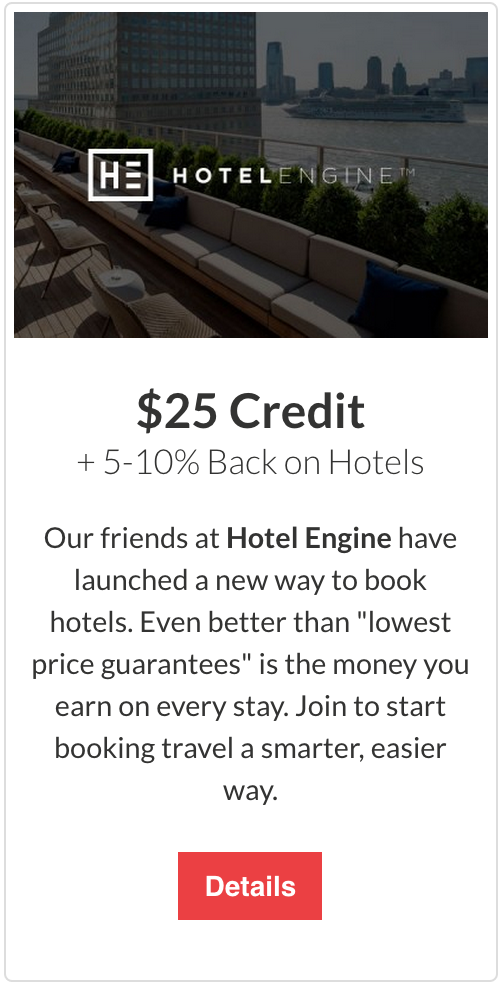
Where is `chair`? chair is located at coordinates (81, 238).